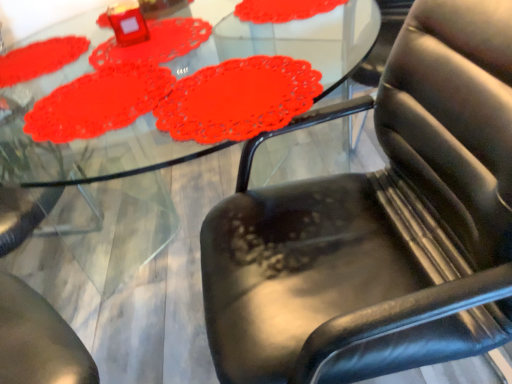
Question: Is matte red doily at upper left, placed as the 1th mat when sorted from front to back, oriented away from matte red doily at upper center, which is the second mat from front to back?

Choices:
 (A) yes
 (B) no

Answer: (B)

Question: Is matte red doily at upper center, which is the second mat from front to back, surrounded by matte red doily at upper left, the third mat from the back?

Choices:
 (A) yes
 (B) no

Answer: (B)

Question: Does matte red doily at upper left, the third mat from the back, have a greater width compared to matte red doily at upper center, the 2th mat viewed from the back?

Choices:
 (A) yes
 (B) no

Answer: (A)

Question: From a real-world perspective, is matte red doily at upper left, placed as the 1th mat when sorted from front to back, over matte red doily at upper center, the 2th mat viewed from the back?

Choices:
 (A) yes
 (B) no

Answer: (A)

Question: Considering the relative positions of matte red doily at upper left, the third mat from the back, and matte red doily at upper center, the 2th mat viewed from the back, in the image provided, is matte red doily at upper left, the third mat from the back, to the right of matte red doily at upper center, the 2th mat viewed from the back, from the viewer's perspective?

Choices:
 (A) no
 (B) yes

Answer: (A)

Question: Based on their positions, is matte red doily at upper left, placed as the 1th mat when sorted from front to back, located to the left or right of matte red doily at upper left, which is the 3th mat from front to back?

Choices:
 (A) left
 (B) right

Answer: (B)

Question: Relative to matte red doily at upper left, which is the 3th mat from front to back, is matte red doily at upper left, the third mat from the back, in front or behind?

Choices:
 (A) behind
 (B) front

Answer: (B)

Question: Is matte red doily at upper left, placed as the 1th mat when sorted from front to back, bigger or smaller than matte red doily at upper left, which is the 1th mat from back to front?

Choices:
 (A) big
 (B) small

Answer: (A)

Question: Is matte red doily at upper left, placed as the 1th mat when sorted from front to back, situated inside matte red doily at upper left, which is the 1th mat from back to front, or outside?

Choices:
 (A) inside
 (B) outside

Answer: (B)

Question: Considering the positions of matte red doily at upper left, which is the 3th mat from front to back, and black leather chair at lower right in the image, is matte red doily at upper left, which is the 3th mat from front to back, wider or thinner than black leather chair at lower right?

Choices:
 (A) thin
 (B) wide

Answer: (A)

Question: In terms of height, does matte red doily at upper left, which is the 3th mat from front to back, look taller or shorter compared to black leather chair at lower right?

Choices:
 (A) short
 (B) tall

Answer: (A)

Question: From the image's perspective, is matte red doily at upper left, which is the 1th mat from back to front, located above or below black leather chair at lower right?

Choices:
 (A) below
 (B) above

Answer: (B)

Question: Is point (33, 56) closer or farther from the camera than point (342, 261)?

Choices:
 (A) farther
 (B) closer

Answer: (A)

Question: From a real-world perspective, relative to matte red doily at upper center, the 2th mat viewed from the back, is black leather chair at lower right vertically above or below?

Choices:
 (A) above
 (B) below

Answer: (B)

Question: Is black leather chair at lower right to the left or to the right of matte red doily at upper center, the 2th mat viewed from the back, in the image?

Choices:
 (A) right
 (B) left

Answer: (A)